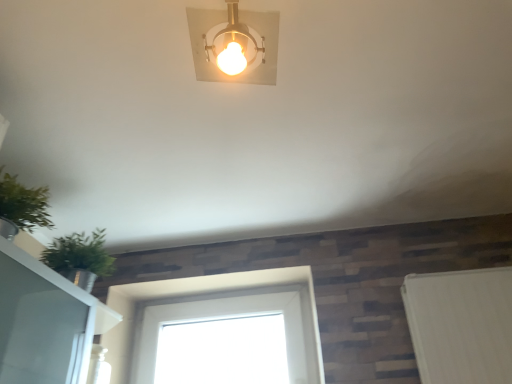
Question: Is gold metallic light fixture at upper center surrounded by green leafy plant at left?

Choices:
 (A) no
 (B) yes

Answer: (A)

Question: From a real-world perspective, is green leafy plant at left located higher than gold metallic light fixture at upper center?

Choices:
 (A) no
 (B) yes

Answer: (A)

Question: Is there a large distance between green leafy plant at left and gold metallic light fixture at upper center?

Choices:
 (A) yes
 (B) no

Answer: (B)

Question: From the image's perspective, would you say green leafy plant at left is shown under gold metallic light fixture at upper center?

Choices:
 (A) yes
 (B) no

Answer: (A)

Question: Does green leafy plant at left have a larger size compared to gold metallic light fixture at upper center?

Choices:
 (A) yes
 (B) no

Answer: (A)

Question: Is point (22, 236) closer or farther from the camera than point (135, 339)?

Choices:
 (A) farther
 (B) closer

Answer: (B)

Question: From a real-world perspective, is green leafy plant at left physically located above or below white glass window at center?

Choices:
 (A) above
 (B) below

Answer: (A)

Question: Is green leafy plant at left wider or thinner than white glass window at center?

Choices:
 (A) wide
 (B) thin

Answer: (A)

Question: Considering the positions of green leafy plant at left and white glass window at center in the image, is green leafy plant at left taller or shorter than white glass window at center?

Choices:
 (A) tall
 (B) short

Answer: (B)

Question: Is gold metallic light fixture at upper center taller or shorter than white glass window at center?

Choices:
 (A) tall
 (B) short

Answer: (B)

Question: Is point (203, 13) positioned closer to the camera than point (117, 327)?

Choices:
 (A) closer
 (B) farther

Answer: (A)

Question: Looking at the image, does gold metallic light fixture at upper center seem bigger or smaller compared to white glass window at center?

Choices:
 (A) big
 (B) small

Answer: (B)

Question: Is gold metallic light fixture at upper center wider or thinner than white glass window at center?

Choices:
 (A) wide
 (B) thin

Answer: (A)

Question: From the image's perspective, is gold metallic light fixture at upper center positioned above or below green leafy plant at left?

Choices:
 (A) below
 (B) above

Answer: (B)

Question: Considering their positions, is gold metallic light fixture at upper center located in front of or behind green leafy plant at left?

Choices:
 (A) front
 (B) behind

Answer: (A)